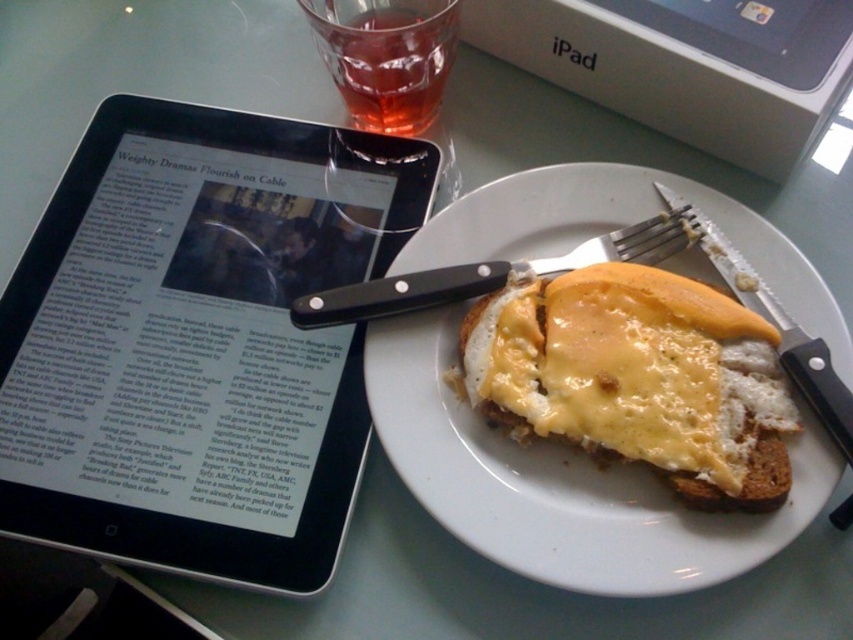
Based on the photo, you are setting up a small tray for a picnic. You have a white ceramic plate at center and a translucent glass at upper center. Which item should you place first if you want to ensure there is enough space for both on the tray?

You should place the white ceramic plate at center first because it is bigger than the translucent glass at upper center, so placing the larger item first ensures there is enough space for both.

You are a chef preparing a meal and need to reach for the black plastic fork at upper right. Which object is closer to your hand when you reach for it compared to the slightly toasted bread with melted cheese at center?

The slightly toasted bread with melted cheese at center is closer to the viewer than the black plastic fork at upper right, so the bread would be closer to your hand when reaching for the fork.

You are a chef standing at the breakfast table. You need to reach the slightly toasted bread with melted cheese at center to add a sprinkle of pepper. Based on the distance between you and the bread, can you estimate how far you need to extend your arm to reach it?

The distance between the slightly toasted bread with melted cheese at center and the camera is 33.99 inches. Assuming the camera represents your eye level, you would need to extend your arm approximately 33.99 inches to reach the bread.